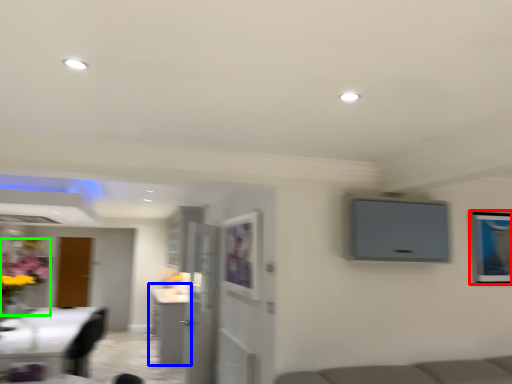
Question: Considering the real-world distances, which object is farthest from picture frame (highlighted by a red box)? cabinetry (highlighted by a blue box) or floral arrangement (highlighted by a green box)?

Choices:
 (A) cabinetry
 (B) floral arrangement

Answer: (B)